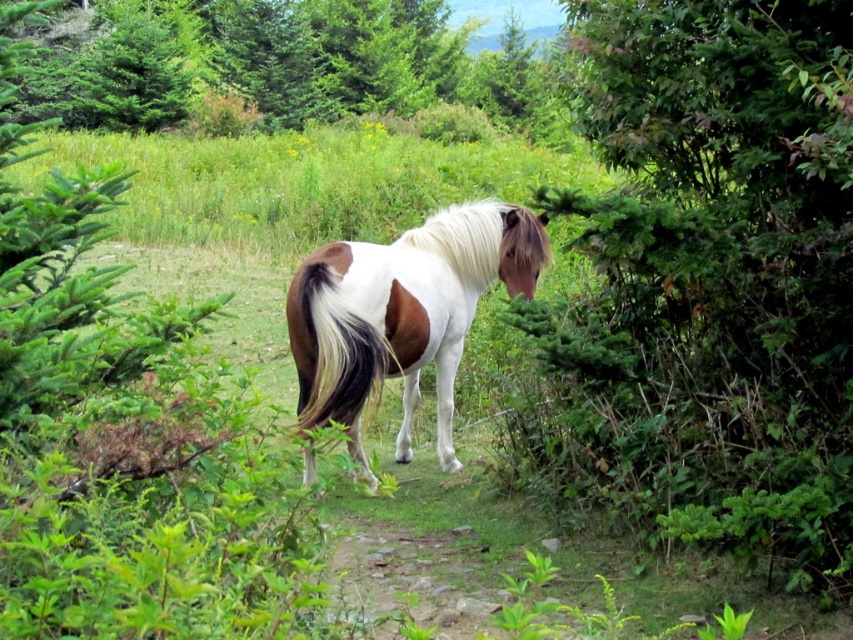
Is green leafy tree at center right below white-brown fur horse at center?

No, green leafy tree at center right is not below white-brown fur horse at center.

Is green leafy tree at center right closer to the viewer compared to white-brown fur horse at center?

That is True.

Which is in front, point (660, 429) or point (450, 362)?

Point (660, 429)

Image resolution: width=853 pixels, height=640 pixels. What are the coordinates of `green leafy tree at center right` in the screenshot? It's located at (712, 278).

Is green leafy tree at center right wider than white silky mane at center?

Yes, green leafy tree at center right is wider than white silky mane at center.

Can you confirm if green leafy tree at center right is taller than white silky mane at center?

Yes, green leafy tree at center right is taller than white silky mane at center.

This screenshot has height=640, width=853. I want to click on green leafy tree at center right, so click(x=712, y=278).

Between green leafy tree at upper center and white-brown fur horse at center, which one has more height?

Standing taller between the two is green leafy tree at upper center.

Between green leafy tree at upper center and white-brown fur horse at center, which one is positioned higher?

Positioned higher is green leafy tree at upper center.

Find the location of a particular element. The image size is (853, 640). green leafy tree at upper center is located at coordinates (279, 64).

Where is `green leafy tree at upper center`? The width and height of the screenshot is (853, 640). green leafy tree at upper center is located at coordinates (279, 64).